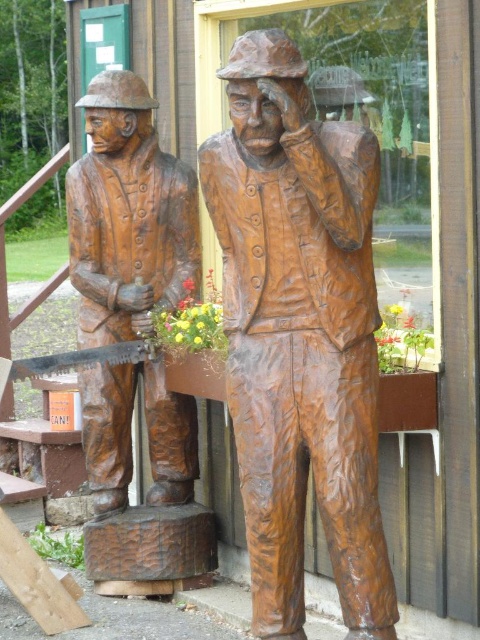
Who is positioned more to the right, bronze wood carving at center or matte brown saw at left?

Positioned to the right is bronze wood carving at center.

Is bronze wood carving at center to the right of matte brown saw at left from the viewer's perspective?

Correct, you'll find bronze wood carving at center to the right of matte brown saw at left.

Who is more forward, (374, 394) or (132, 248)?

Point (374, 394) is more forward.

Locate an element on the screen. The width and height of the screenshot is (480, 640). bronze wood carving at center is located at coordinates (300, 336).